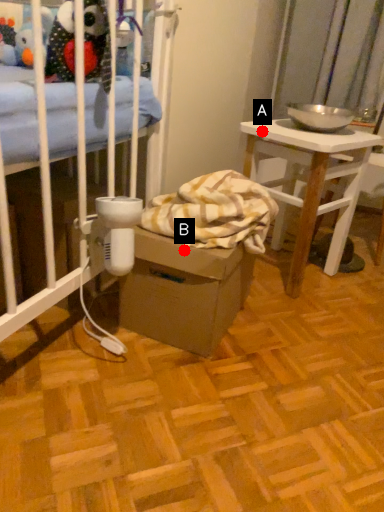
Question: Two points are circled on the image, labeled by A and B beside each circle. Among these points, which one is nearest to the camera?

Choices:
 (A) A is closer
 (B) B is closer

Answer: (B)